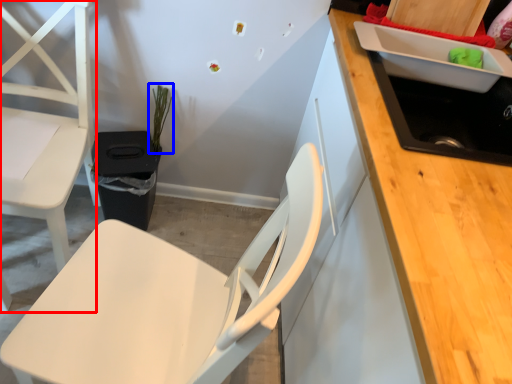
Question: Which object appears farthest to the camera in this image, chair (highlighted by a red box) or plant (highlighted by a blue box)?

Choices:
 (A) chair
 (B) plant

Answer: (B)